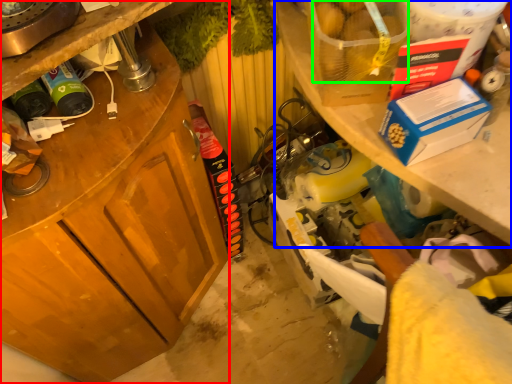
Question: Which object is the farthest from cabinetry (highlighted by a red box)? Choose among these: shelf (highlighted by a blue box) or food (highlighted by a green box).

Choices:
 (A) shelf
 (B) food

Answer: (B)